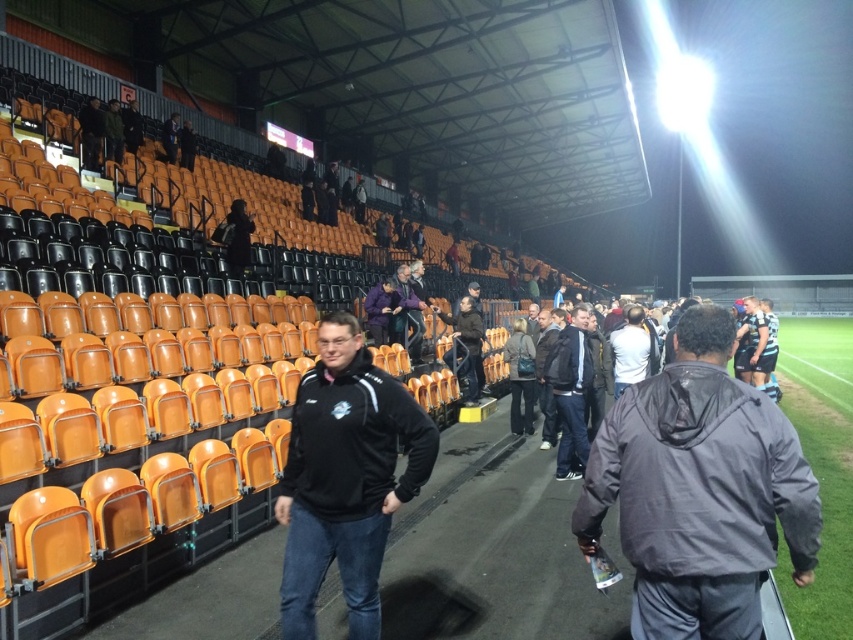
Question: Which object is positioned closest to the dark blue jacket at center?

Choices:
 (A) gray matte jacket at center
 (B) black matte jacket at center

Answer: (B)

Question: Estimate the real-world distances between objects in this image. Which object is closer to the gray matte jacket at center?

Choices:
 (A) dark brown leather jacket at center
 (B) purple softshell jacket at upper center

Answer: (B)

Question: Can you confirm if gray matte jacket at center is positioned to the left of dark blue jacket at center?

Choices:
 (A) yes
 (B) no

Answer: (A)

Question: From the image, what is the correct spatial relationship of black matte jacket at center in relation to purple softshell jacket at upper center?

Choices:
 (A) above
 (B) below

Answer: (B)

Question: Does black matte jacket at center have a lesser width compared to dark blue jacket at center?

Choices:
 (A) yes
 (B) no

Answer: (B)

Question: Which point is closer to the camera?

Choices:
 (A) (606, 458)
 (B) (352, 396)
 (C) (393, 317)

Answer: (A)